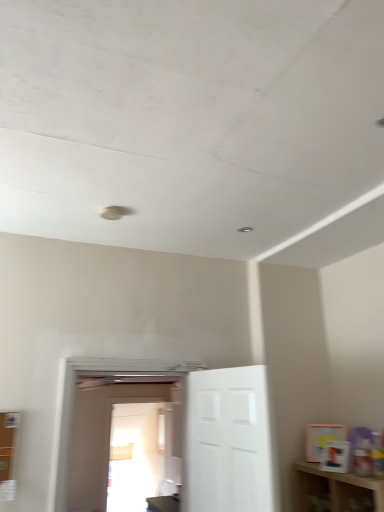
Question: Is transparent glass door at center to the left of white matte door at center, positioned as the second door in left-to-right order, from the viewer's perspective?

Choices:
 (A) yes
 (B) no

Answer: (A)

Question: Does transparent glass door at center have a larger size compared to white matte door at center, the 1th door in the right-to-left sequence?

Choices:
 (A) no
 (B) yes

Answer: (A)

Question: Is transparent glass door at center thinner than white matte door at center, positioned as the second door in left-to-right order?

Choices:
 (A) no
 (B) yes

Answer: (B)

Question: Is transparent glass door at center shorter than white matte door at center, positioned as the second door in left-to-right order?

Choices:
 (A) yes
 (B) no

Answer: (B)

Question: Is transparent glass door at center wider than white matte door at center, positioned as the second door in left-to-right order?

Choices:
 (A) no
 (B) yes

Answer: (A)

Question: From a real-world perspective, is transparent glass door at center physically below white matte door at center, the 1th door in the right-to-left sequence?

Choices:
 (A) yes
 (B) no

Answer: (A)

Question: Is transparent glass door at center bigger than white glossy door at center, the first door viewed from the left?

Choices:
 (A) no
 (B) yes

Answer: (A)

Question: From the image's perspective, is transparent glass door at center over white glossy door at center, the first door viewed from the left?

Choices:
 (A) yes
 (B) no

Answer: (B)

Question: Is transparent glass door at center in front of white glossy door at center, the first door viewed from the left?

Choices:
 (A) yes
 (B) no

Answer: (B)

Question: From a real-world perspective, is transparent glass door at center over white glossy door at center, arranged as the second door when viewed from the right?

Choices:
 (A) yes
 (B) no

Answer: (B)

Question: From a real-world perspective, does transparent glass door at center sit lower than white glossy door at center, the first door viewed from the left?

Choices:
 (A) no
 (B) yes

Answer: (B)

Question: Is the depth of transparent glass door at center greater than that of white glossy door at center, arranged as the second door when viewed from the right?

Choices:
 (A) no
 (B) yes

Answer: (B)

Question: Considering the relative sizes of white matte door at center, the 1th door in the right-to-left sequence, and transparent glass door at center in the image provided, is white matte door at center, the 1th door in the right-to-left sequence, smaller than transparent glass door at center?

Choices:
 (A) no
 (B) yes

Answer: (A)